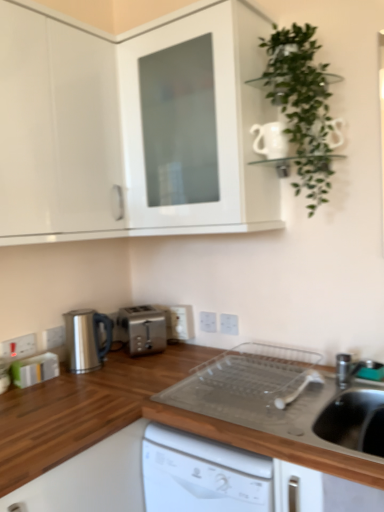
Question: Which direction should I rotate to face white plastic electric outlet at center, which ranks as the third electric outlet in left-to-right order, — up or down?

Choices:
 (A) up
 (B) down

Answer: (B)

Question: Can you confirm if satin silver kettle at lower left is smaller than green rubber tap at lower right?

Choices:
 (A) yes
 (B) no

Answer: (B)

Question: From a real-world perspective, is satin silver kettle at lower left below green rubber tap at lower right?

Choices:
 (A) no
 (B) yes

Answer: (A)

Question: Is satin silver kettle at lower left shorter than green rubber tap at lower right?

Choices:
 (A) no
 (B) yes

Answer: (A)

Question: From the image's perspective, would you say satin silver kettle at lower left is positioned over green rubber tap at lower right?

Choices:
 (A) yes
 (B) no

Answer: (A)

Question: Is satin silver kettle at lower left oriented towards green rubber tap at lower right?

Choices:
 (A) no
 (B) yes

Answer: (B)

Question: Is satin silver kettle at lower left thinner than green rubber tap at lower right?

Choices:
 (A) yes
 (B) no

Answer: (B)

Question: Is white plastic electric outlet at lower left, arranged as the 2th electric outlet when viewed from the front, aimed at green rubber tap at lower right?

Choices:
 (A) no
 (B) yes

Answer: (B)

Question: Is white plastic electric outlet at lower left, which appears as the 2th electric outlet when viewed from the left, bigger than green rubber tap at lower right?

Choices:
 (A) no
 (B) yes

Answer: (A)

Question: Does white plastic electric outlet at lower left, the 4th electric outlet from the right, lie in front of green rubber tap at lower right?

Choices:
 (A) yes
 (B) no

Answer: (B)

Question: Does white plastic electric outlet at lower left, the 4th electric outlet from the right, appear on the left side of green rubber tap at lower right?

Choices:
 (A) yes
 (B) no

Answer: (A)

Question: From the image's perspective, is white plastic electric outlet at lower left, the 4th electric outlet from the right, below green rubber tap at lower right?

Choices:
 (A) yes
 (B) no

Answer: (B)

Question: Is white plastic electric outlet at lower left, which appears as the 2th electric outlet when viewed from the left, smaller than green rubber tap at lower right?

Choices:
 (A) yes
 (B) no

Answer: (A)

Question: From a real-world perspective, is green rubber tap at lower right on top of white plastic electric outlet at center, which ranks as the third electric outlet in left-to-right order?

Choices:
 (A) no
 (B) yes

Answer: (A)